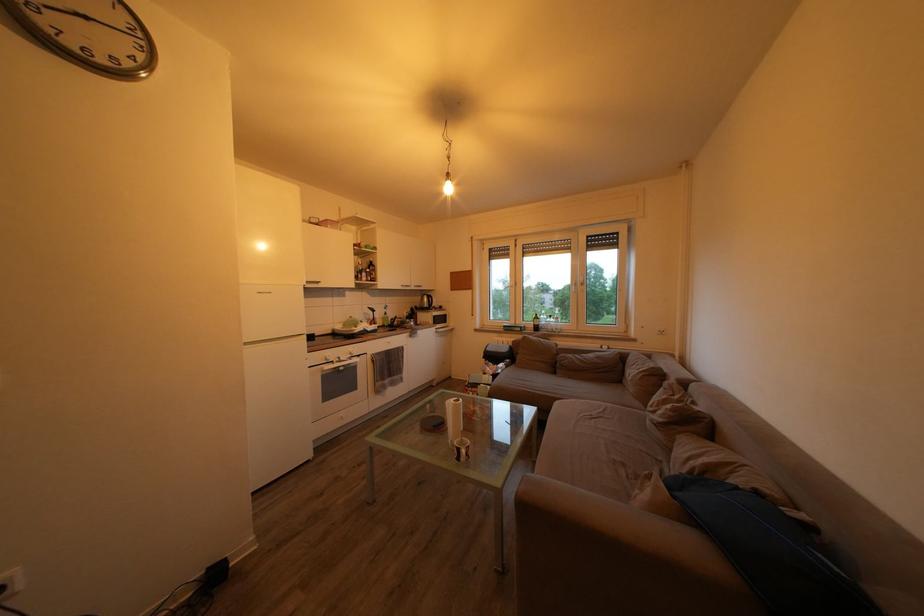
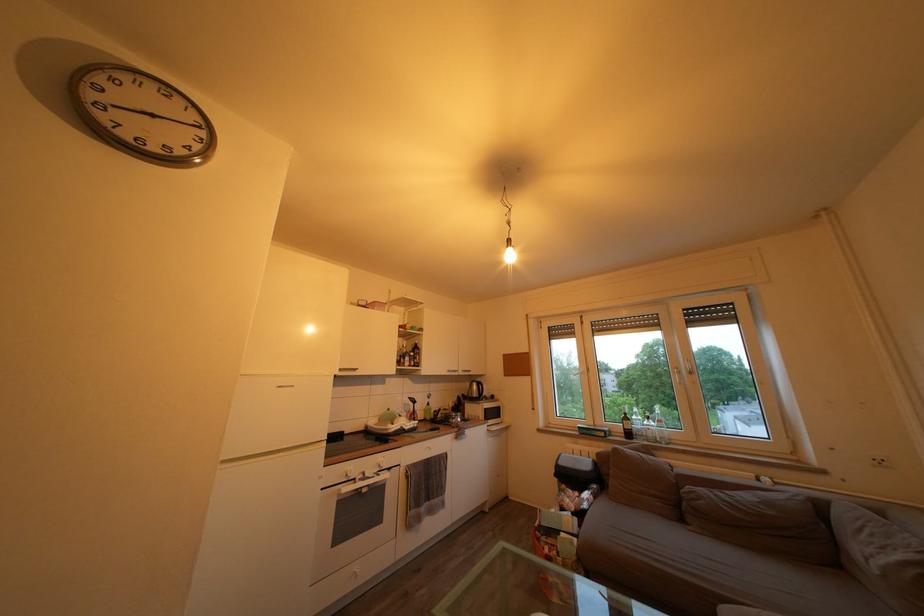
In the second image, find the point that corresponds to point 670,339 in the first image.

(889, 468)